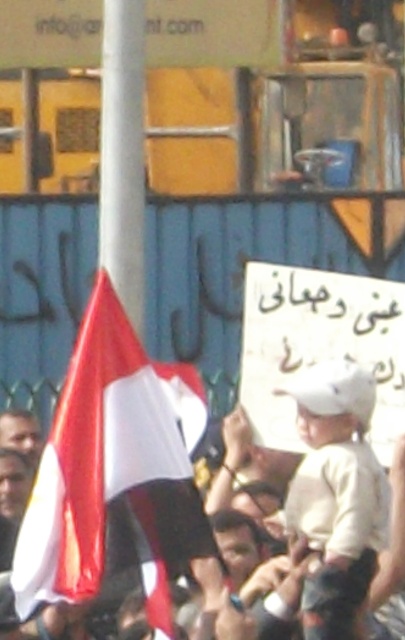
Question: Which point is closer to the camera?

Choices:
 (A) white fabric flag at center
 (B) white paper placard at center

Answer: (A)

Question: In this image, where is white fabric flag at center located relative to white paper placard at center?

Choices:
 (A) below
 (B) above

Answer: (A)

Question: Is white fabric flag at center smaller than white paper placard at center?

Choices:
 (A) yes
 (B) no

Answer: (B)

Question: Based on their relative distances, which object is nearer to the white fabric flag at center?

Choices:
 (A) white cotton hat at center
 (B) white paper placard at center

Answer: (A)

Question: Which of these objects is positioned farthest from the white cotton hat at center?

Choices:
 (A) white fabric flag at center
 (B) white paper placard at center

Answer: (A)

Question: Does white paper placard at center appear on the left side of white cotton hat at center?

Choices:
 (A) no
 (B) yes

Answer: (A)